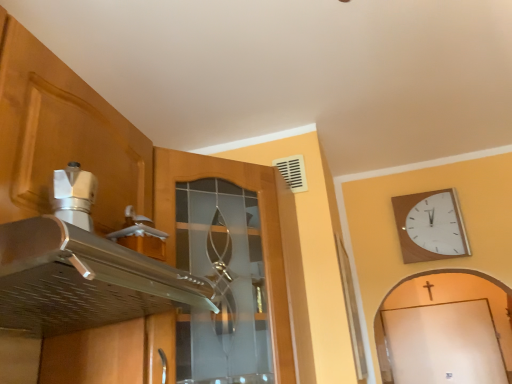
Question: Considering the relative positions of wooden wall clock at upper right and silver metallic exhaust hood at upper left in the image provided, is wooden wall clock at upper right in front of silver metallic exhaust hood at upper left?

Choices:
 (A) no
 (B) yes

Answer: (A)

Question: Can you confirm if wooden wall clock at upper right is thinner than silver metallic exhaust hood at upper left?

Choices:
 (A) no
 (B) yes

Answer: (B)

Question: Is wooden wall clock at upper right shorter than silver metallic exhaust hood at upper left?

Choices:
 (A) no
 (B) yes

Answer: (A)

Question: From a real-world perspective, is wooden wall clock at upper right physically above silver metallic exhaust hood at upper left?

Choices:
 (A) no
 (B) yes

Answer: (B)

Question: Could you tell me if wooden wall clock at upper right is turned towards silver metallic exhaust hood at upper left?

Choices:
 (A) yes
 (B) no

Answer: (B)

Question: Can you see wooden wall clock at upper right touching silver metallic exhaust hood at upper left?

Choices:
 (A) yes
 (B) no

Answer: (B)

Question: Is matte wood cabinet at upper left bigger than wooden wall clock at upper right?

Choices:
 (A) no
 (B) yes

Answer: (B)

Question: Does matte wood cabinet at upper left have a smaller size compared to wooden wall clock at upper right?

Choices:
 (A) no
 (B) yes

Answer: (A)

Question: Considering the relative sizes of matte wood cabinet at upper left and wooden wall clock at upper right in the image provided, is matte wood cabinet at upper left wider than wooden wall clock at upper right?

Choices:
 (A) no
 (B) yes

Answer: (B)

Question: Does matte wood cabinet at upper left come in front of wooden wall clock at upper right?

Choices:
 (A) yes
 (B) no

Answer: (A)

Question: Does matte wood cabinet at upper left come behind wooden wall clock at upper right?

Choices:
 (A) no
 (B) yes

Answer: (A)

Question: Is matte wood cabinet at upper left at the left side of wooden wall clock at upper right?

Choices:
 (A) yes
 (B) no

Answer: (A)

Question: Does silver metallic exhaust hood at upper left have a smaller size compared to matte wood cabinet at upper left?

Choices:
 (A) yes
 (B) no

Answer: (A)